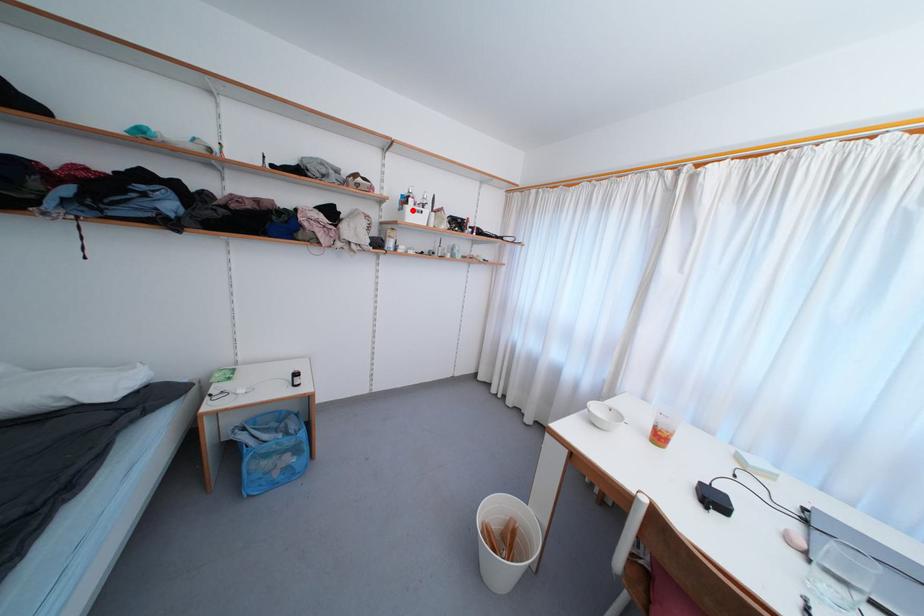
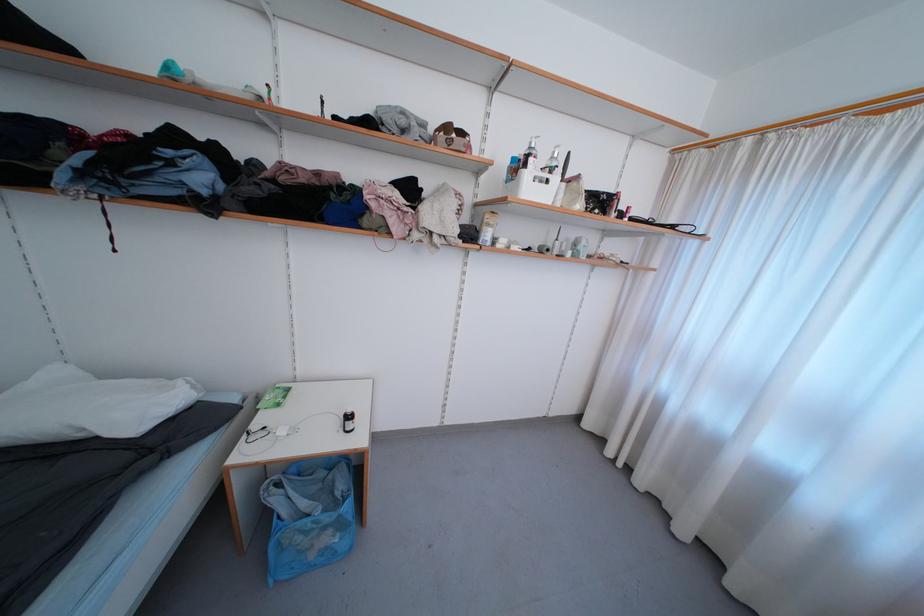
In the second image, find the point that corresponds to the highlighted location in the first image.

(531, 177)